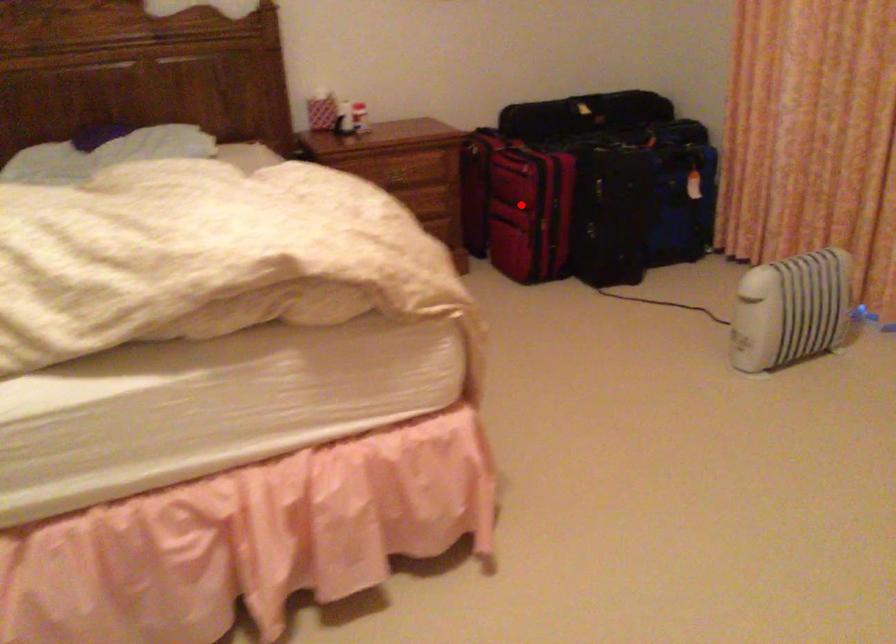
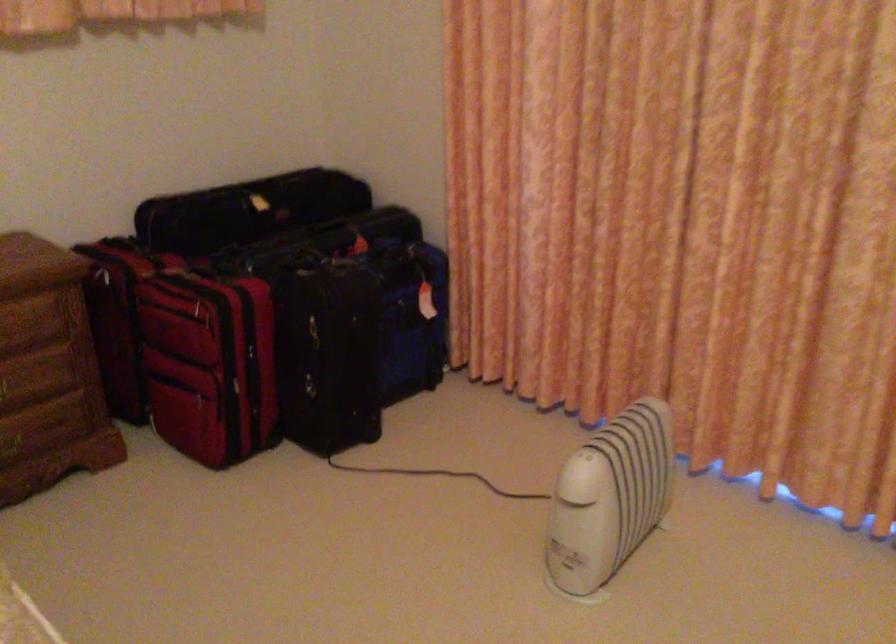
Locate, in the second image, the point that corresponds to the highlighted location in the first image.

(209, 364)